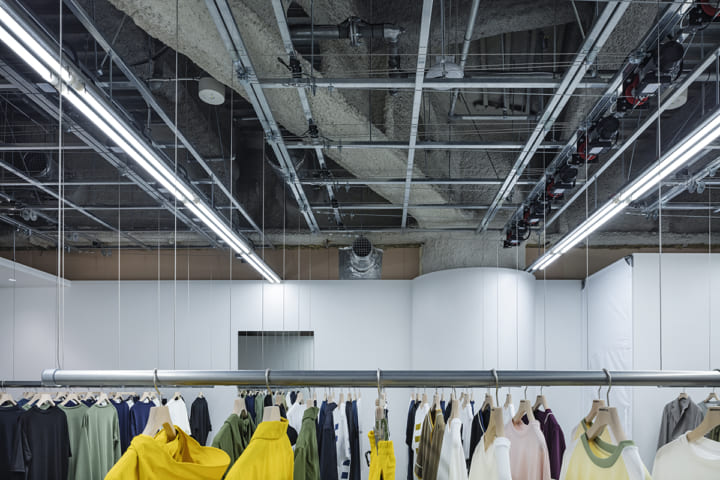
You are a GUI agent. You are given a task and a screenshot of the screen. Output one action in this format:
    pyautogui.click(x=<x>, y=<y>)
    Task: Click on the rods
    
    Given the screenshot: What is the action you would take?
    pyautogui.click(x=567, y=248)